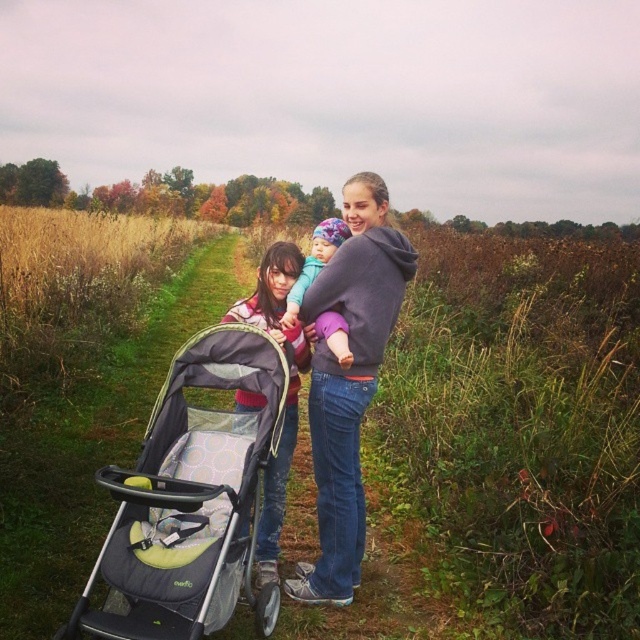
Describe the element at coordinates (189, 497) in the screenshot. I see `black fabric stroller at center` at that location.

Who is more distant from viewer, (218, 600) or (268, 250)?

The point (268, 250) is more distant.

The height and width of the screenshot is (640, 640). What are the coordinates of `black fabric stroller at center` in the screenshot? It's located at (189, 497).

The image size is (640, 640). I want to click on black fabric stroller at center, so click(x=189, y=497).

Which is behind, point (378, 340) or point (296, 433)?

The point (296, 433) is behind.

Does gray hoodie at center appear over matte pink sweater at center?

Correct, gray hoodie at center is located above matte pink sweater at center.

At what (x,y) coordinates should I click in order to perform the action: click on gray hoodie at center. Please return your answer as a coordinate pair (x, y). Image resolution: width=640 pixels, height=640 pixels. Looking at the image, I should click on (348, 381).

At what (x,y) coordinates should I click in order to perform the action: click on gray hoodie at center. Please return your answer as a coordinate pair (x, y). This screenshot has width=640, height=640. Looking at the image, I should click on (348, 381).

Based on the photo, who is lower down, black fabric stroller at center or gray hoodie at center?

black fabric stroller at center is lower down.

What do you see at coordinates (189, 497) in the screenshot? Image resolution: width=640 pixels, height=640 pixels. I see `black fabric stroller at center` at bounding box center [189, 497].

The width and height of the screenshot is (640, 640). I want to click on black fabric stroller at center, so click(x=189, y=497).